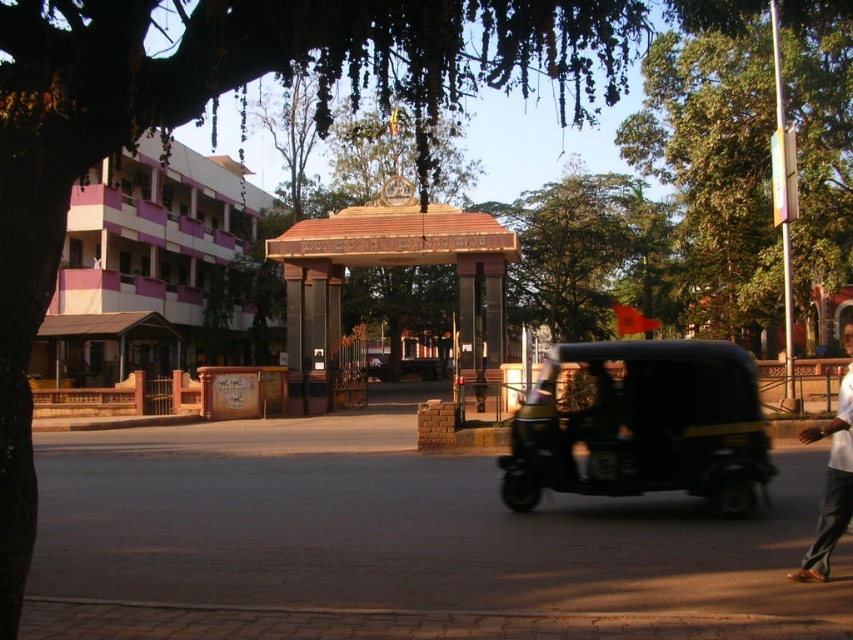
Question: Is green leafy tree at upper right behind black matte auto-rickshaw at center?

Choices:
 (A) yes
 (B) no

Answer: (B)

Question: Which point is farther to the camera?

Choices:
 (A) white cotton shirt at lower right
 (B) black matte auto-rickshaw at center

Answer: (B)

Question: Which object appears farthest from the camera in this image?

Choices:
 (A) black matte auto-rickshaw at center
 (B) green leafy tree at upper right

Answer: (A)

Question: Is black matte auto-rickshaw at center wider than white cotton shirt at lower right?

Choices:
 (A) no
 (B) yes

Answer: (A)

Question: Which point appears closest to the camera in this image?

Choices:
 (A) (535, 493)
 (B) (824, 502)

Answer: (B)

Question: Is green leafy tree at upper right above white cotton shirt at lower right?

Choices:
 (A) yes
 (B) no

Answer: (A)